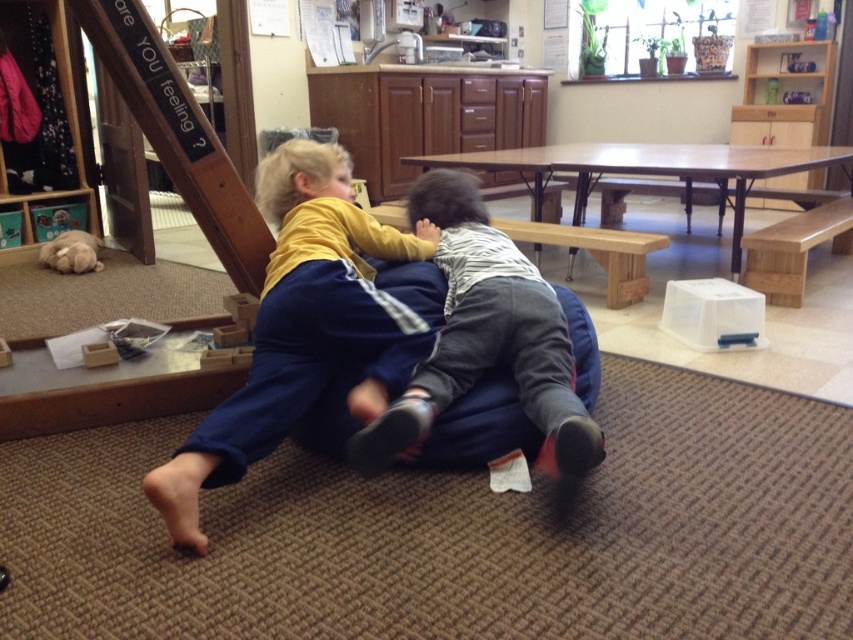
You are a photographer trying to capture a candid shot of the two children playing on the large blue beanbag chair. You need to ensure both the matte yellow shirt at center and the striped cotton shirt at center are clearly visible in the photo. Given their sizes, which shirt might you need to position closer to the camera to ensure it doesn

The matte yellow shirt at center is bigger than the striped cotton shirt at center. To ensure both are clearly visible, you should position the striped cotton shirt at center closer to the camera since its smaller size might require better focus and visibility compared to the larger matte yellow shirt at center.

You are a photographer trying to capture a candid shot of the two children playing on the large blue beanbag chair. You want to ensure that the matte yellow shirt at center and the striped cotton shirt at center are both clearly visible in the photo. Based on their positions, which child should you focus on to ensure both shirts are in frame?

The matte yellow shirt at center is below striped cotton shirt at center, so focusing on the striped cotton shirt at center will ensure both shirts are visible in the photo.

You are standing at the origin point of the coordinate system in the image. The origin is at the bottom left corner of the image. The coordinates are normalized between 0 and 1. Where is the matte yellow shirt at center located in terms of its x and y coordinates?

The matte yellow shirt at center is located at coordinates x 0.511 and y 0.353.